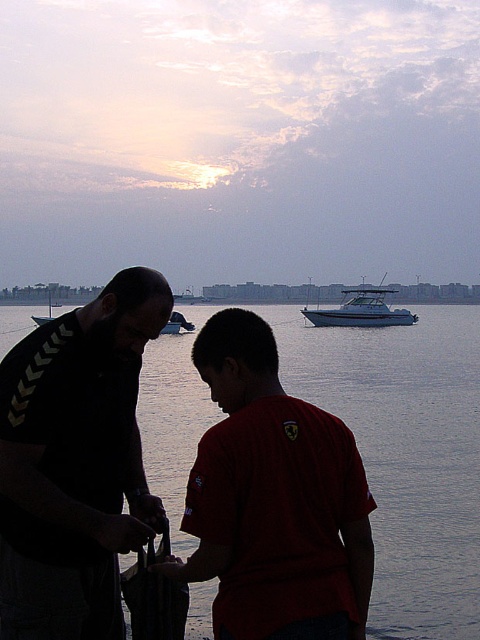
From the picture: You are an observer looking at the scene. You see the smooth water at center and the metallic silver boat at center. Which object takes up more space in the image?

The smooth water at center takes up more space in the image than the metallic silver boat at center because it is bigger.